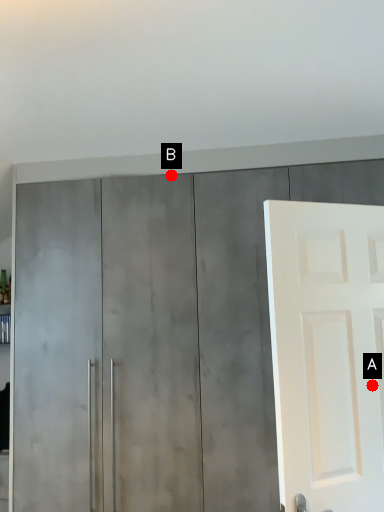
Question: Two points are circled on the image, labeled by A and B beside each circle. Which point appears closest to the camera in this image?

Choices:
 (A) A is closer
 (B) B is closer

Answer: (A)